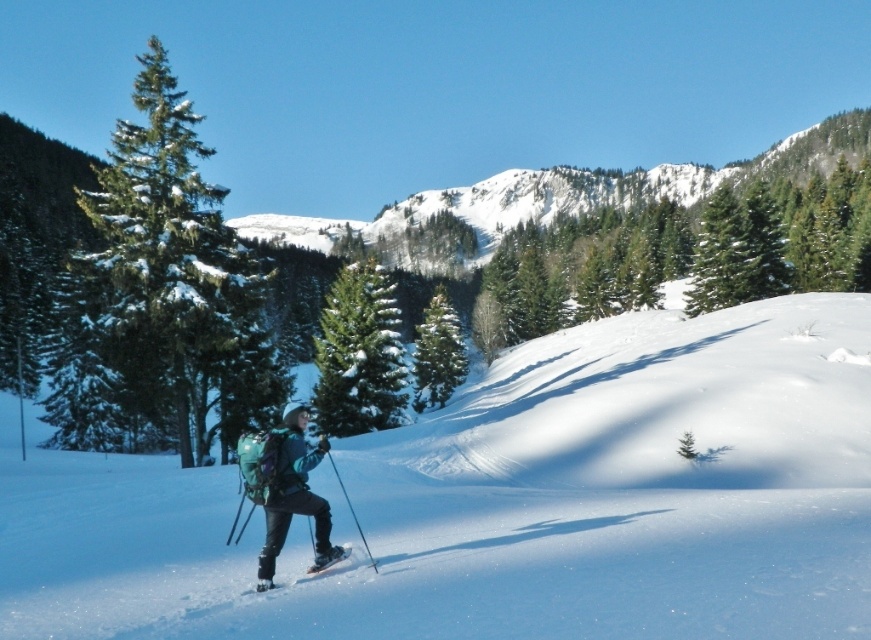
Question: Is green textured pine at center wider than green textured pine tree at center?

Choices:
 (A) no
 (B) yes

Answer: (B)

Question: Which object appears closest to the camera in this image?

Choices:
 (A) green evergreen tree at left
 (B) green textured pine at center
 (C) shiny metallic ski at lower center
 (D) shiny black ski at lower center

Answer: (C)

Question: Does green evergreen tree at left have a larger size compared to green textured pine at center?

Choices:
 (A) no
 (B) yes

Answer: (B)

Question: Considering the real-world distances, which object is closest to the green textured pine at center?

Choices:
 (A) green textured pine tree at center
 (B) shiny metallic ski at lower center
 (C) matte blue jacket at center
 (D) shiny black ski at lower center

Answer: (C)

Question: Can you confirm if green evergreen tree at left is positioned above shiny metallic ski at lower center?

Choices:
 (A) no
 (B) yes

Answer: (B)

Question: Which point is closer to the camera?

Choices:
 (A) (260, 579)
 (B) (342, 320)

Answer: (A)